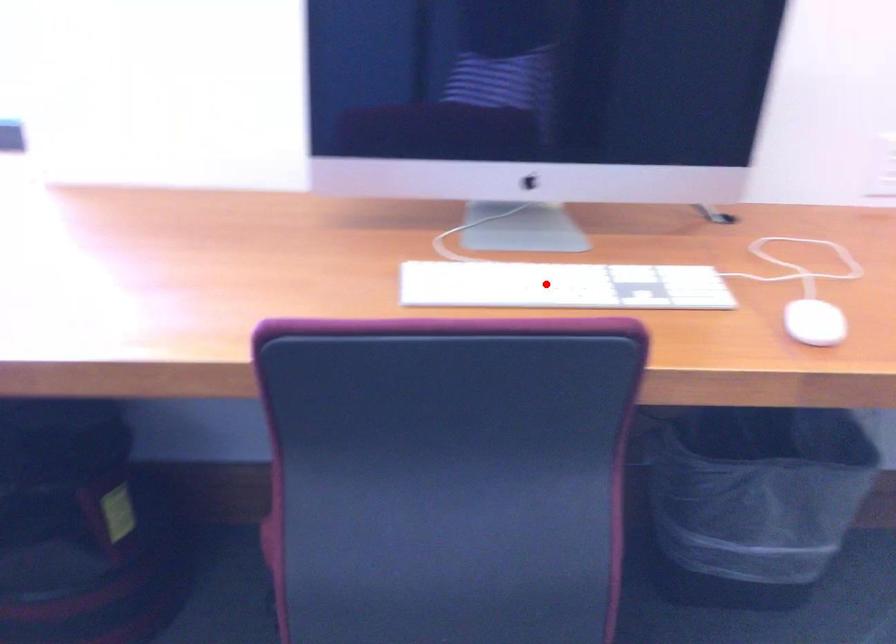
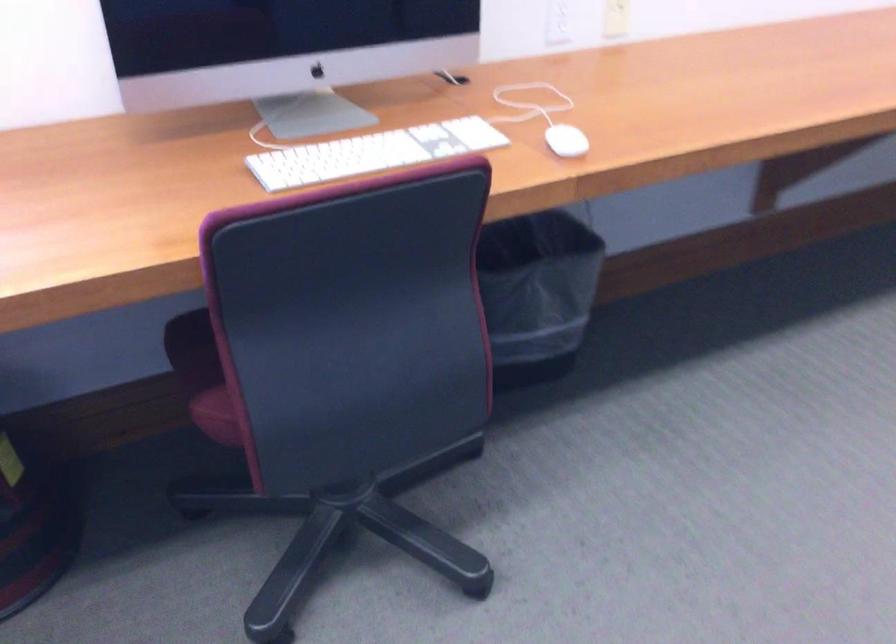
Find the pixel in the second image that matches the highlighted location in the first image.

(372, 153)